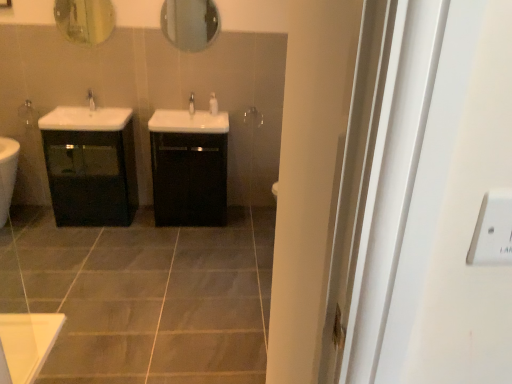
Where is `vacant area that lies between black glossy cabinet at center, which appears as the 2th bathroom cabinet when viewed from the left, and matte black cabinet at left, the second bathroom cabinet in the right-to-left sequence`? The image size is (512, 384). vacant area that lies between black glossy cabinet at center, which appears as the 2th bathroom cabinet when viewed from the left, and matte black cabinet at left, the second bathroom cabinet in the right-to-left sequence is located at coordinates (146, 221).